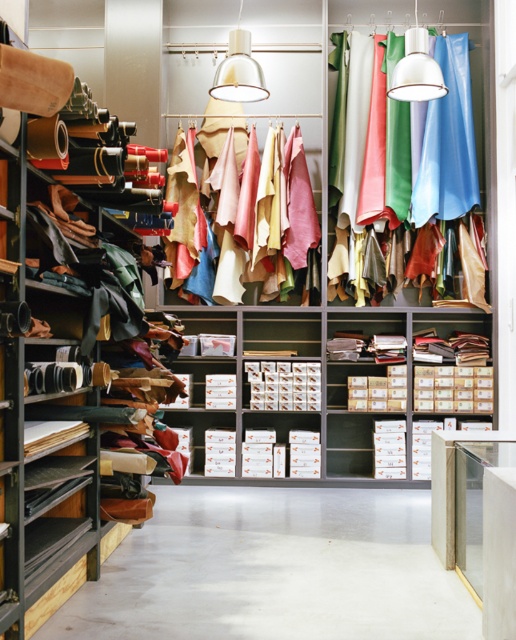
Is point (413, 28) closer to camera compared to point (466, 164)?

Yes, point (413, 28) is in front of point (466, 164).

Can you confirm if shiny leather fabric at upper center is wider than matte blue leather jacket at upper right?

Yes, shiny leather fabric at upper center is wider than matte blue leather jacket at upper right.

Does point (345, 195) lie behind point (450, 147)?

That is True.

The image size is (516, 640). I want to click on shiny leather fabric at upper center, so click(372, 138).

Does suede leather at center have a lesser width compared to matte blue leather jacket at upper right?

Incorrect, suede leather at center's width is not less than matte blue leather jacket at upper right's.

Is point (281, 140) positioned before point (476, 173)?

Yes, point (281, 140) is in front of point (476, 173).

Between point (282, 276) and point (427, 179), which one is positioned in front?

Point (427, 179) is more forward.

Locate an element on the screen. The height and width of the screenshot is (640, 516). suede leather at center is located at coordinates (282, 211).

Does shiny leather fabric at upper center have a larger size compared to suede leather at center?

Yes.

Is shiny leather fabric at upper center taller than suede leather at center?

Yes.

Who is more forward, (338,64) or (284,168)?

Point (284,168) is in front.

Identify the location of shiny leather fabric at upper center. This screenshot has width=516, height=640. (372, 138).